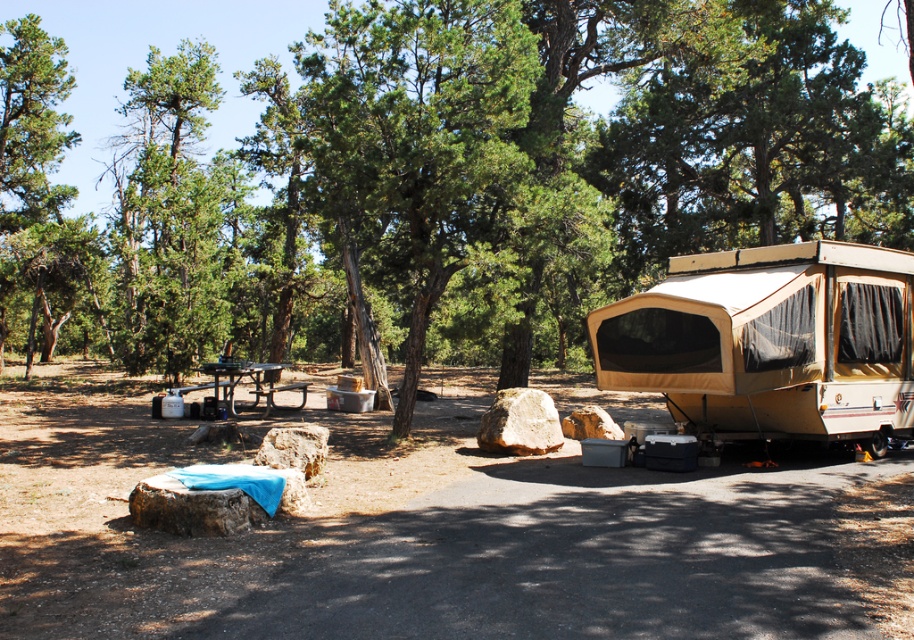
Which is more to the right, tan fabric camper at right or metallic picnic table at center?

From the viewer's perspective, tan fabric camper at right appears more on the right side.

Who is taller, tan fabric camper at right or metallic picnic table at center?

With more height is tan fabric camper at right.

Does point (629, 348) come farther from viewer compared to point (234, 381)?

No, (629, 348) is closer to viewer.

Identify the location of tan fabric camper at right. The height and width of the screenshot is (640, 914). (771, 340).